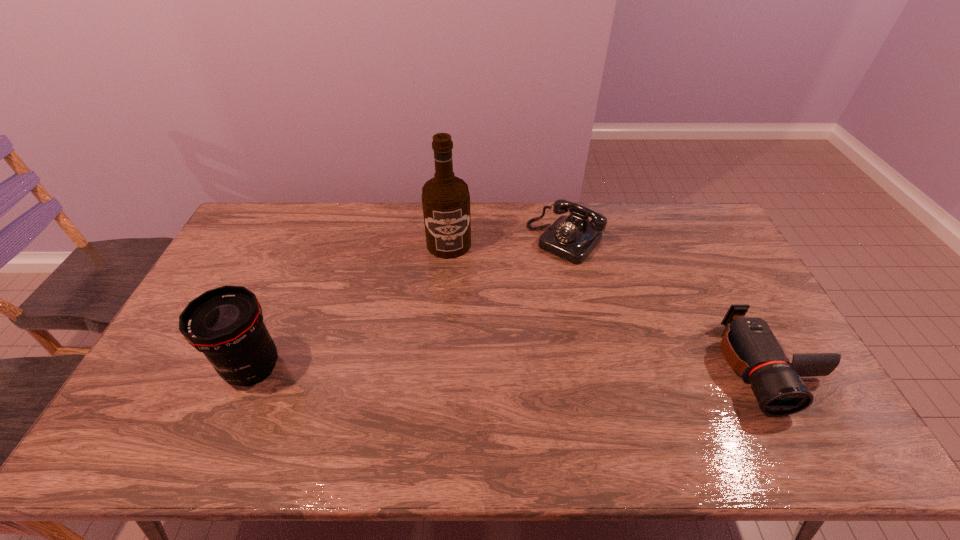
The image size is (960, 540). Identify the location of free space on the desktop that is between the telephoto lens and the camcorder and is positioned on the dial of the telephone. (445, 368).

Find the location of a particular element. vacant spot on the desktop that is between the third shortest object and the camcorder and is positioned on the label of the third object from right to left is located at coordinates (461, 368).